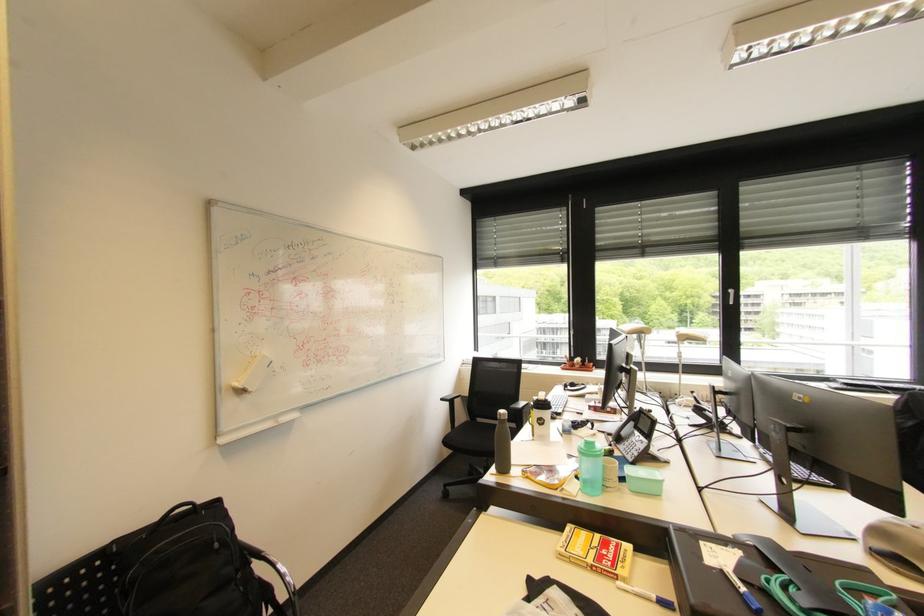
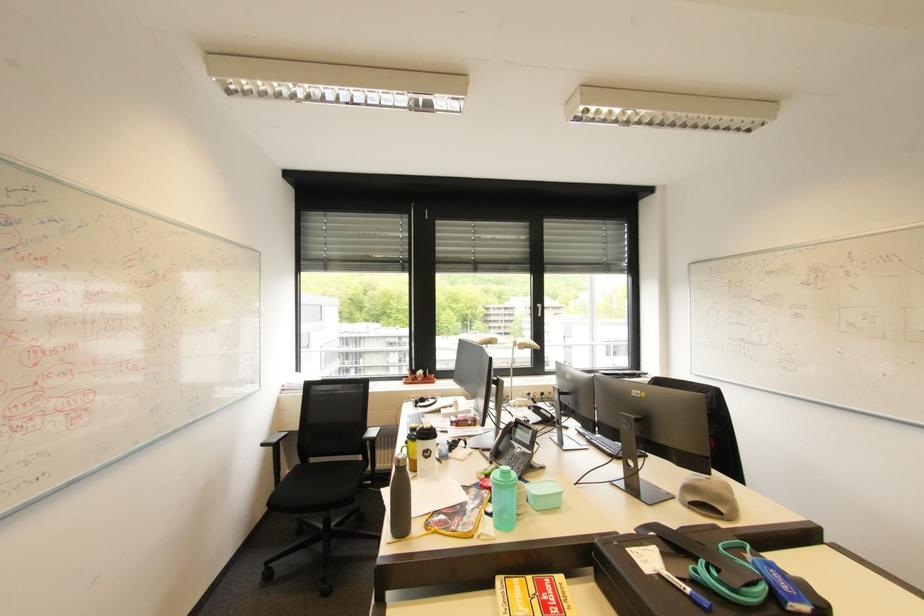
Where in the second image is the point corresponding to point (517, 407) from the first image?

(370, 438)